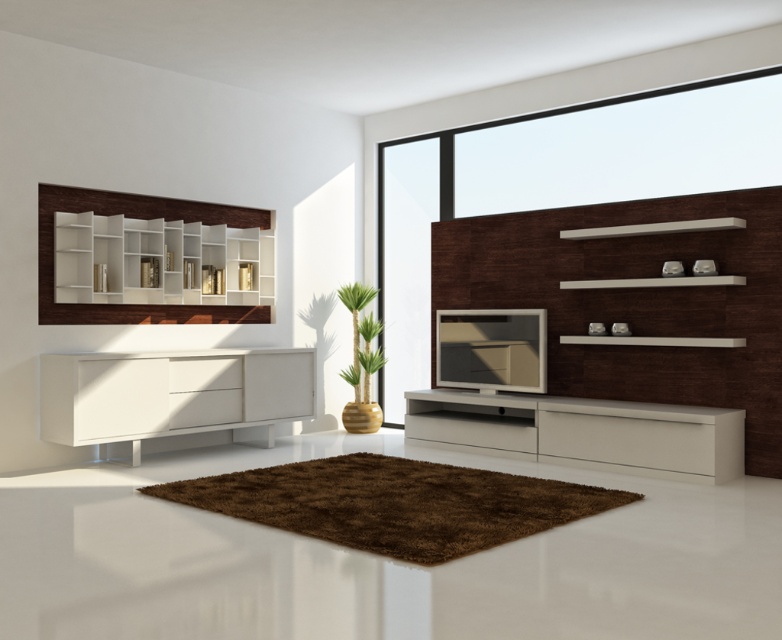
Question: Is transparent glass window at upper right bigger than white matte sideboard at left?

Choices:
 (A) yes
 (B) no

Answer: (A)

Question: Which point is closer to the camera?

Choices:
 (A) (680, 150)
 (B) (691, 408)
 (C) (74, 208)
 (D) (63, 404)

Answer: (D)

Question: Does transparent glass window at upper right appear over white glossy tv stand at center?

Choices:
 (A) no
 (B) yes

Answer: (B)

Question: Which object is farther from the camera taking this photo?

Choices:
 (A) white glossy tv stand at center
 (B) white matte sideboard at left
 (C) white wood shelves at upper left
 (D) transparent glass window at upper right

Answer: (D)

Question: Can you confirm if transparent glass window at upper right is bigger than white matte sideboard at left?

Choices:
 (A) no
 (B) yes

Answer: (B)

Question: Which object is positioned closest to the white glossy tv stand at center?

Choices:
 (A) transparent glass window at upper right
 (B) white matte sideboard at left
 (C) white wood shelves at upper left

Answer: (B)